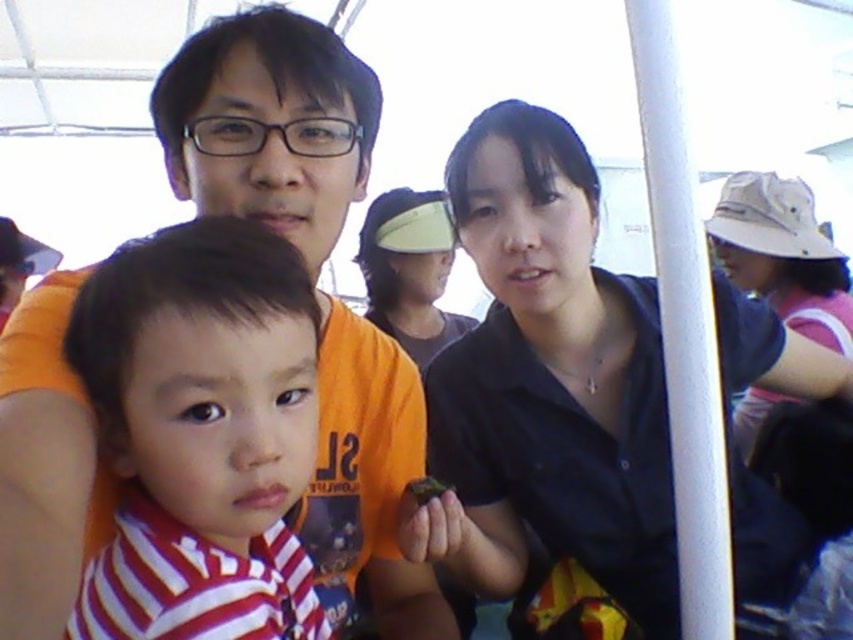
Who is positioned more to the left, orange matte shirt at center or matte yellow visor at center?

From the viewer's perspective, orange matte shirt at center appears more on the left side.

Locate an element on the screen. This screenshot has width=853, height=640. orange matte shirt at center is located at coordinates (270, 124).

Where is `orange matte shirt at center`? orange matte shirt at center is located at coordinates (270, 124).

Where is `orange matte shirt at center`? The height and width of the screenshot is (640, 853). orange matte shirt at center is located at coordinates (270, 124).

Is point (200, 208) farther from viewer compared to point (283, 605)?

Yes, it is.

Which is above, orange matte shirt at center or striped fabric shirt at center?

orange matte shirt at center is higher up.

Locate an element on the screen. orange matte shirt at center is located at coordinates (270, 124).

Can you confirm if black matte shirt at center is positioned to the left of beige fabric hat at upper right?

Yes, black matte shirt at center is to the left of beige fabric hat at upper right.

Can you confirm if black matte shirt at center is positioned below beige fabric hat at upper right?

Indeed, black matte shirt at center is positioned under beige fabric hat at upper right.

Who is more distant from viewer, [659,324] or [769,202]?

Positioned behind is point [769,202].

Locate an element on the screen. The width and height of the screenshot is (853, 640). black matte shirt at center is located at coordinates (547, 385).